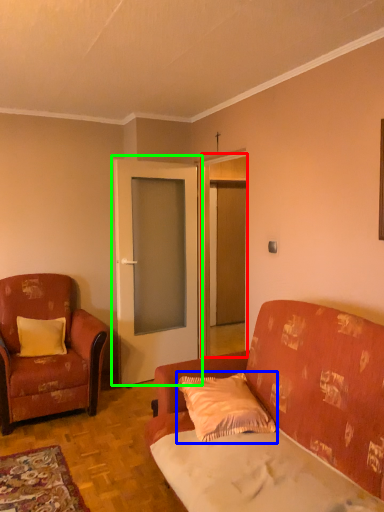
Question: Which object is the farthest from door (highlighted by a red box)? Choose among these: pillow (highlighted by a blue box) or door (highlighted by a green box).

Choices:
 (A) pillow
 (B) door

Answer: (A)